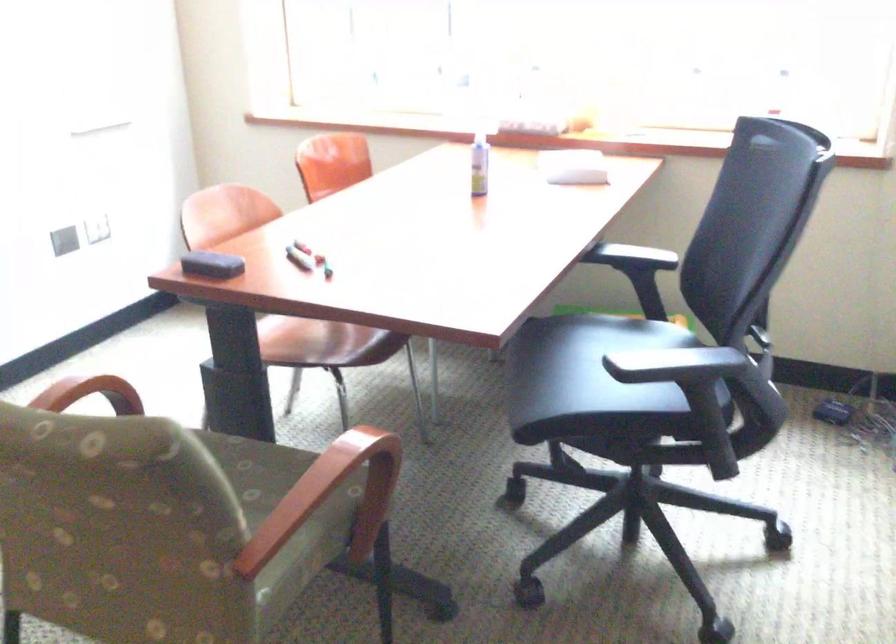
Where is `white spray bottle`? white spray bottle is located at coordinates (478, 164).